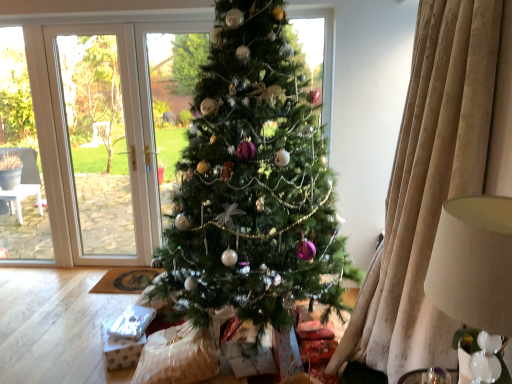
Question: Considering the positions of green matte christmas tree at center and beige fabric lampshade at right in the image, is green matte christmas tree at center bigger or smaller than beige fabric lampshade at right?

Choices:
 (A) big
 (B) small

Answer: (A)

Question: From a real-world perspective, is green matte christmas tree at center positioned above or below beige fabric lampshade at right?

Choices:
 (A) above
 (B) below

Answer: (A)

Question: In terms of width, does green matte christmas tree at center look wider or thinner when compared to beige fabric lampshade at right?

Choices:
 (A) wide
 (B) thin

Answer: (A)

Question: Considering the relative positions of beige fabric lampshade at right and green matte christmas tree at center in the image provided, is beige fabric lampshade at right to the left or to the right of green matte christmas tree at center?

Choices:
 (A) right
 (B) left

Answer: (A)

Question: Considering the positions of point (480, 276) and point (266, 145), is point (480, 276) closer or farther from the camera than point (266, 145)?

Choices:
 (A) closer
 (B) farther

Answer: (A)

Question: From a real-world perspective, is beige fabric lampshade at right positioned above or below green matte christmas tree at center?

Choices:
 (A) above
 (B) below

Answer: (B)

Question: Looking at the image, does beige fabric lampshade at right seem bigger or smaller compared to green matte christmas tree at center?

Choices:
 (A) big
 (B) small

Answer: (B)